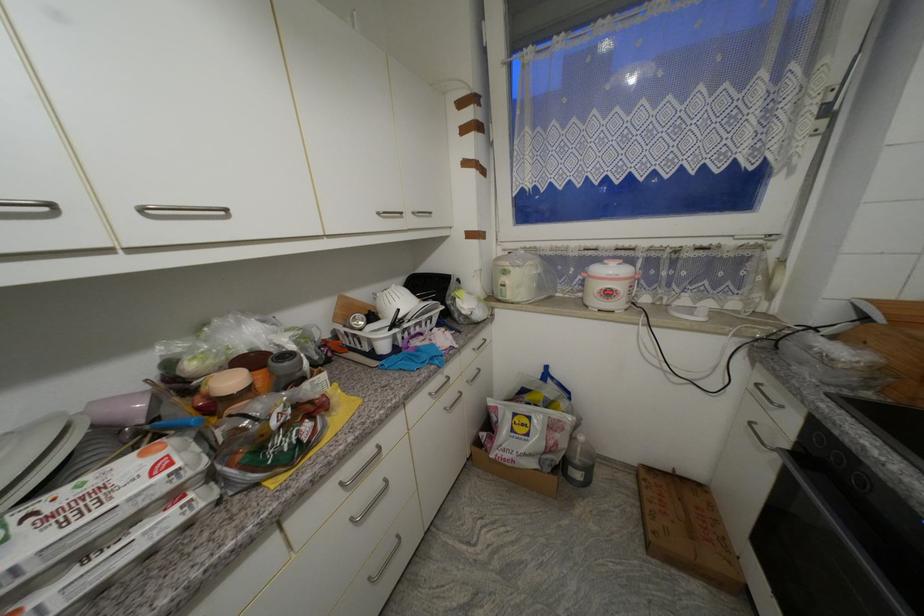
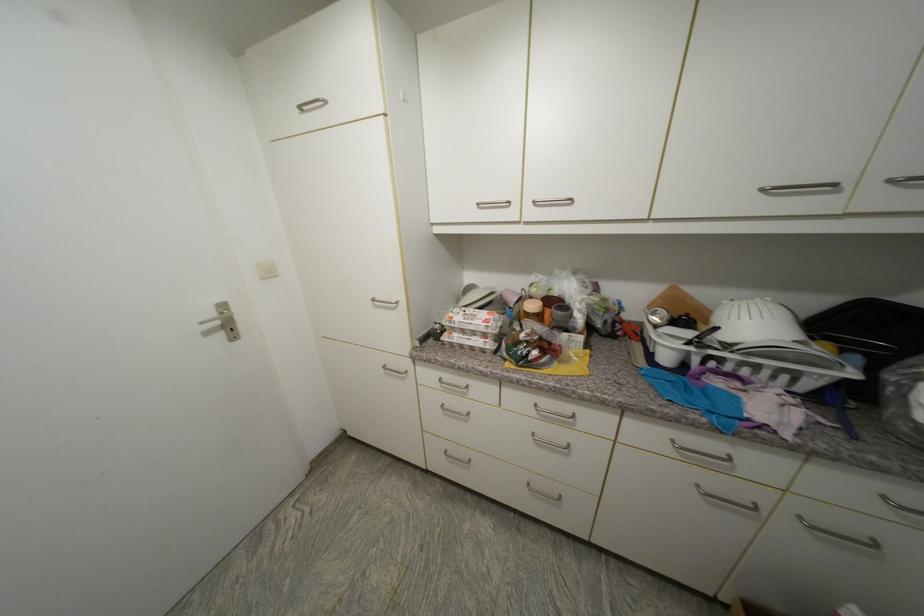
Locate, in the second image, the point that corresponds to pixel 149 211 in the first image.

(540, 204)